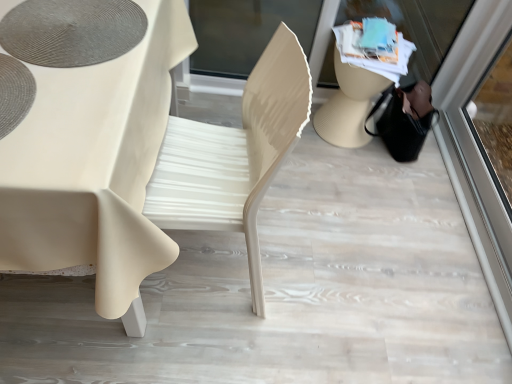
Identify the location of free space underneath matte gray placemat at upper left (from a real-world perspective). This screenshot has width=512, height=384. (52, 23).